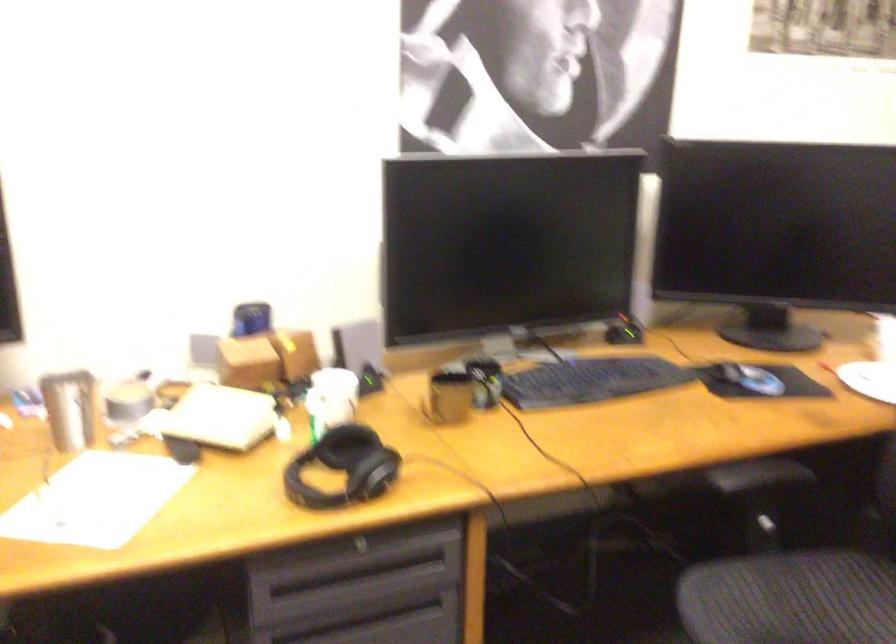
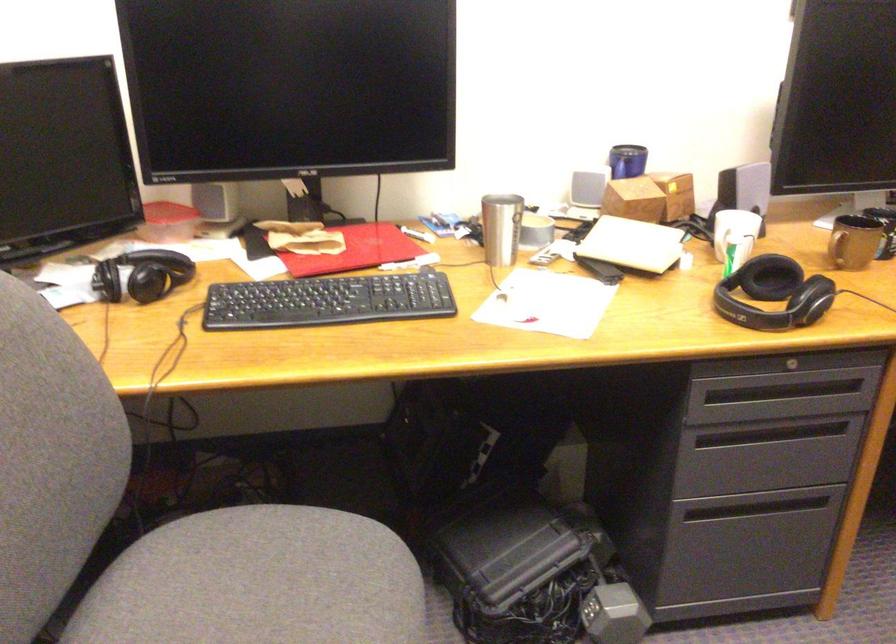
The point at (367, 547) is marked in the first image. Where is the corresponding point in the second image?

(794, 365)